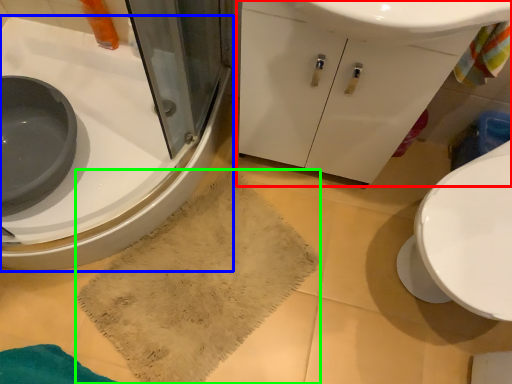
Question: Which is farther away from bathroom cabinet (highlighted by a red box)? sink (highlighted by a blue box) or bath towel (highlighted by a green box)?

Choices:
 (A) sink
 (B) bath towel

Answer: (A)